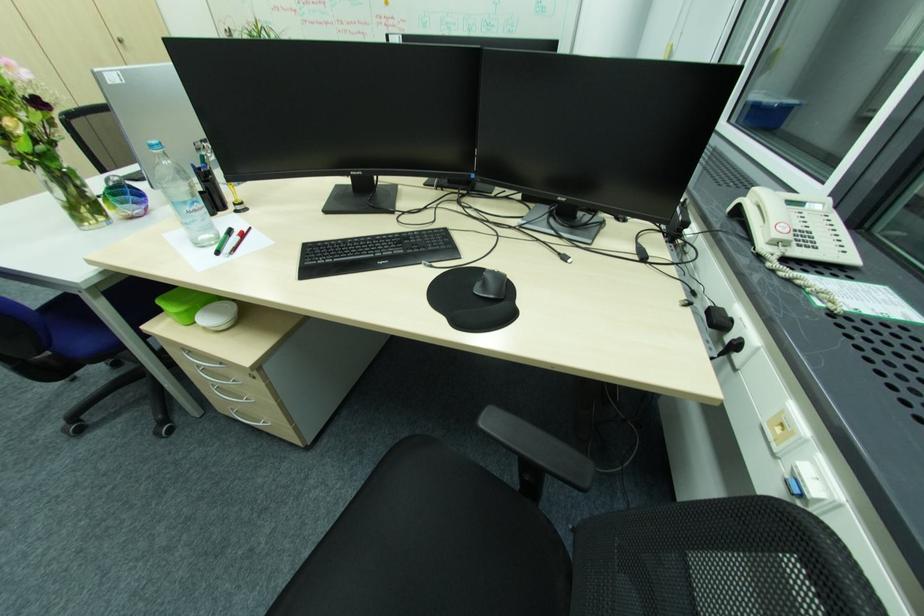
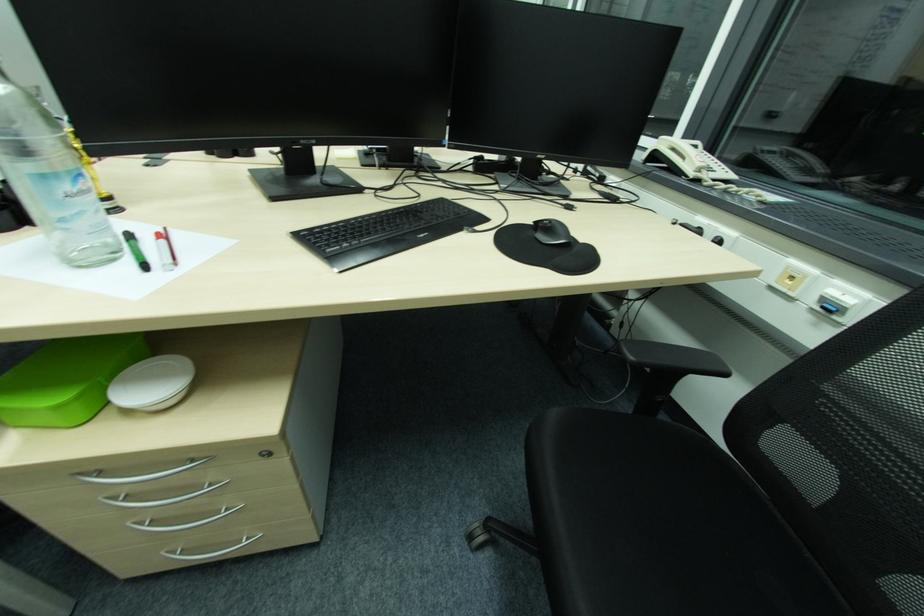
The point at (248,400) is marked in the first image. Where is the corresponding point in the second image?

(225, 513)